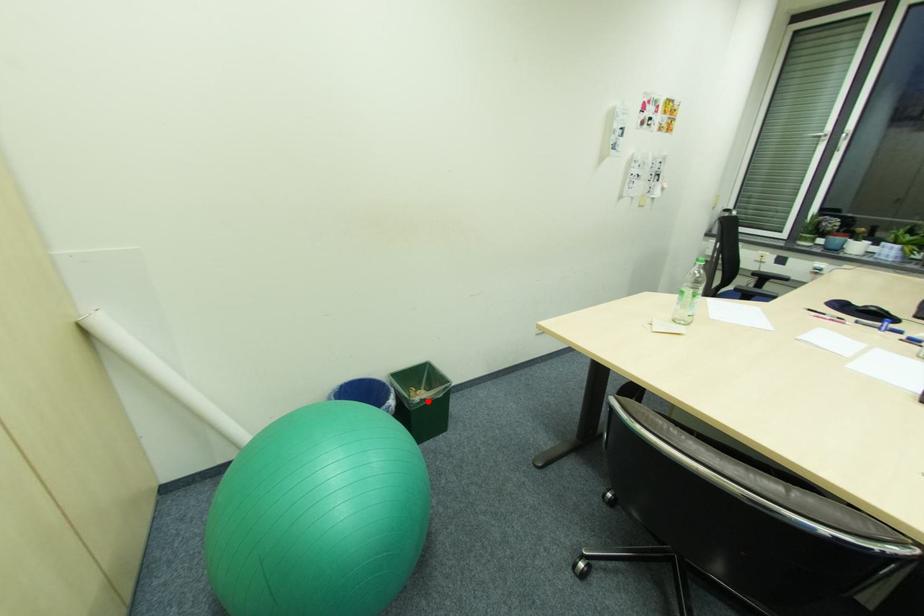
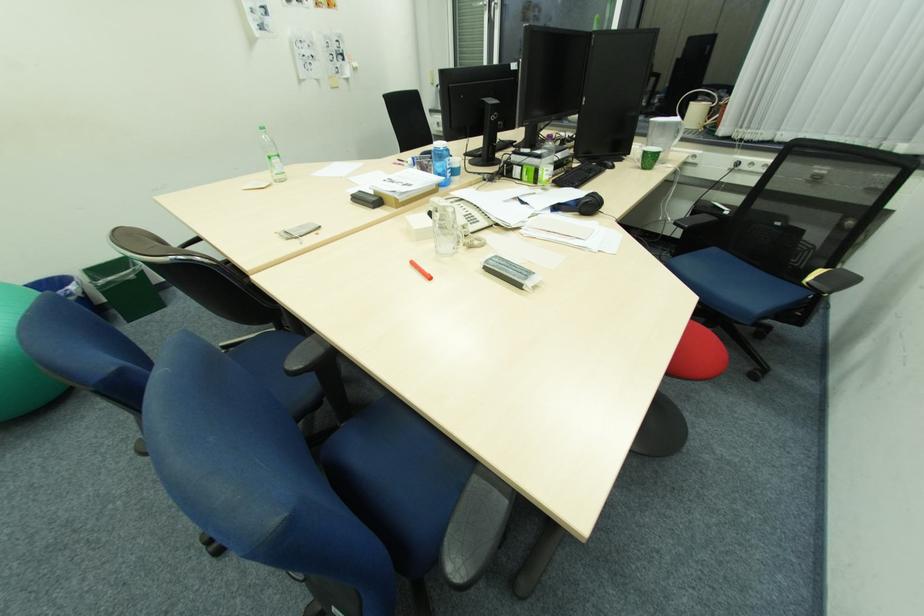
Locate, in the second image, the point that corresponds to the highlighted location in the first image.

(115, 284)